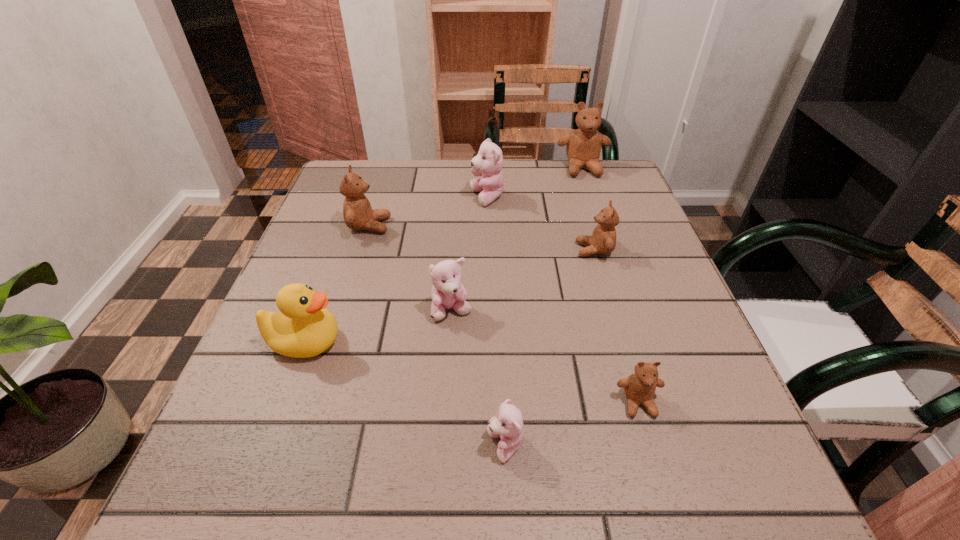
Where is `free point between the third biggest brown teddy bear and the nearest pink teddy bear`? free point between the third biggest brown teddy bear and the nearest pink teddy bear is located at coordinates pyautogui.click(x=550, y=348).

The width and height of the screenshot is (960, 540). I want to click on unoccupied position between the biggest pink teddy bear and the duck, so click(x=396, y=270).

This screenshot has width=960, height=540. Identify the location of vacant space in between the second biggest pink teddy bear and the farthest pink teddy bear. tap(469, 254).

Where is `vacant area that lies between the farthest object and the fifth farthest teddy bear`? vacant area that lies between the farthest object and the fifth farthest teddy bear is located at coordinates (517, 240).

Where is `vacant area that lies between the leftmost teddy bear and the second nearest object`? The width and height of the screenshot is (960, 540). vacant area that lies between the leftmost teddy bear and the second nearest object is located at coordinates (504, 314).

Locate an element on the screen. The image size is (960, 540). free space between the seventh nearest object and the fifth farthest teddy bear is located at coordinates (469, 254).

The image size is (960, 540). Find the location of `object that stands as the seventh closest to the fifth farthest teddy bear`. object that stands as the seventh closest to the fifth farthest teddy bear is located at coordinates (583, 148).

Where is `the second closest object relative to the nearest teddy bear`? Image resolution: width=960 pixels, height=540 pixels. the second closest object relative to the nearest teddy bear is located at coordinates (447, 292).

You are a GUI agent. You are given a task and a screenshot of the screen. Output one action in this format:
    pyautogui.click(x=<x>, y=<y>)
    Task: Click on the second closest teddy bear to the second nearest object
    This screenshot has height=540, width=960.
    Given the screenshot: What is the action you would take?
    pyautogui.click(x=447, y=292)

Identify which teddy bear is located as the fourth nearest to the nearest brown teddy bear. Please provide its 2D coordinates. Your answer should be formatted as a tuple, i.e. [(x, y)], where the tuple contains the x and y coordinates of a point satisfying the conditions above.

[(488, 163)]